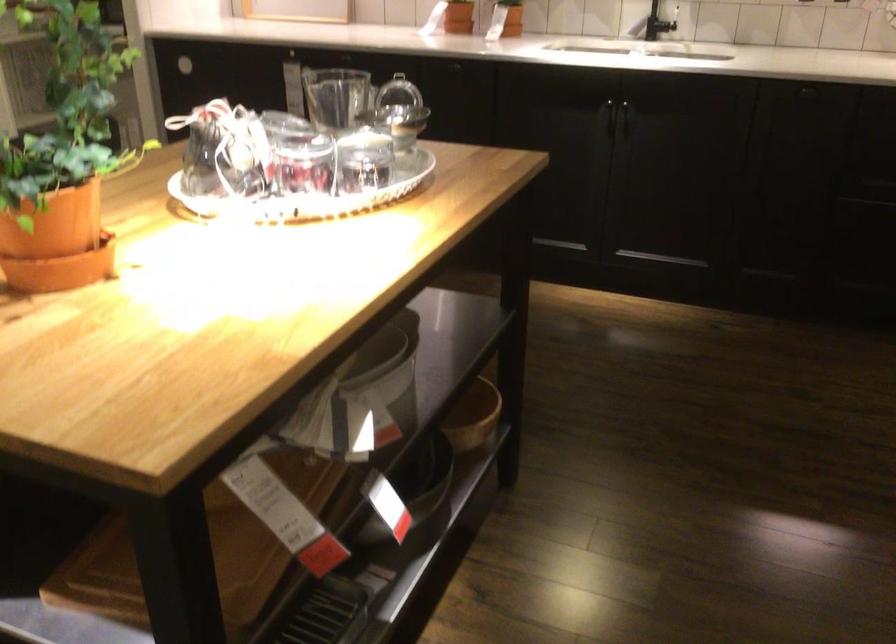
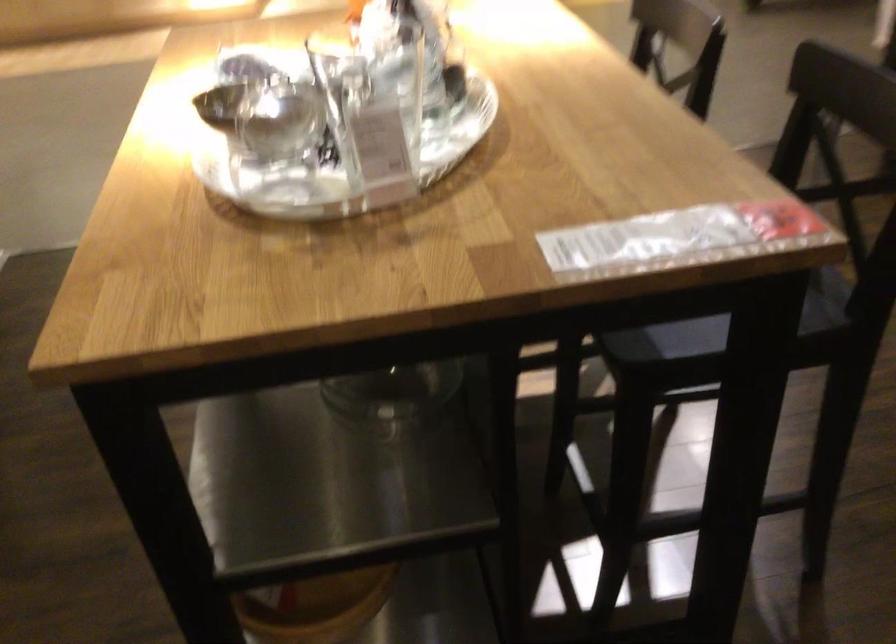
Question: I am providing you with two images of the same scene from different viewpoints. After the viewpoint changes to image2, which objects are now occluded?

Choices:
 (A) wooden storage crate
 (B) clear glass bottle
 (C) silver bowl
 (D) white bucket

Answer: (D)